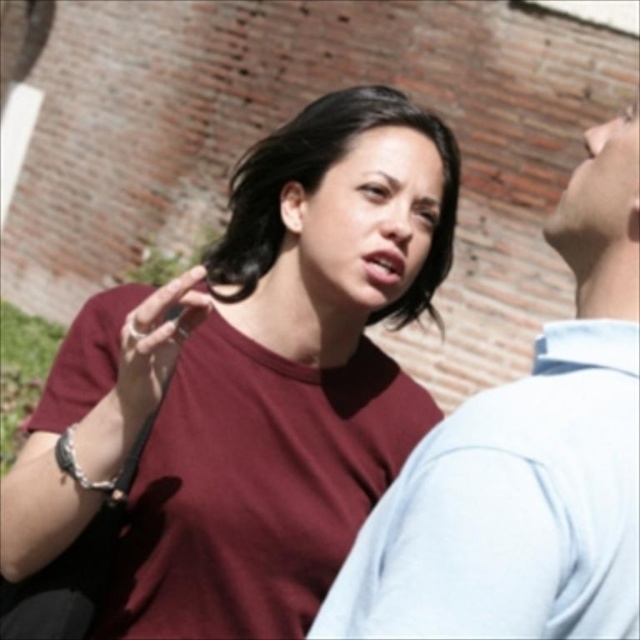
Question: Can you confirm if maroon cotton t-shirt at center is bigger than matte black hand at center?

Choices:
 (A) no
 (B) yes

Answer: (B)

Question: Which object appears farthest from the camera in this image?

Choices:
 (A) matte black hand at center
 (B) maroon cotton t-shirt at center
 (C) light blue cotton shirt at upper right

Answer: (B)

Question: Which of the following is the farthest from the observer?

Choices:
 (A) (68, 410)
 (B) (486, 636)
 (C) (131, 346)

Answer: (A)

Question: Which point is farther to the camera?

Choices:
 (A) (476, 432)
 (B) (154, 358)

Answer: (B)

Question: Is maroon cotton t-shirt at center wider than matte black hand at center?

Choices:
 (A) yes
 (B) no

Answer: (A)

Question: Is light blue cotton shirt at upper right closer to the viewer compared to matte black hand at center?

Choices:
 (A) yes
 (B) no

Answer: (A)